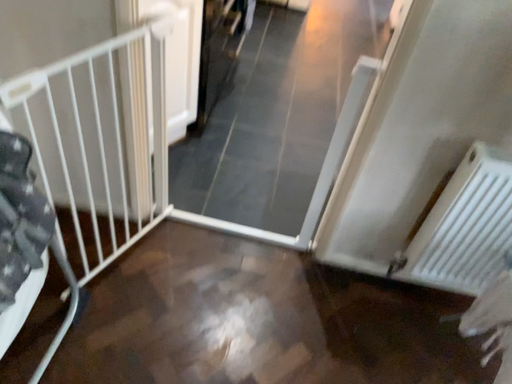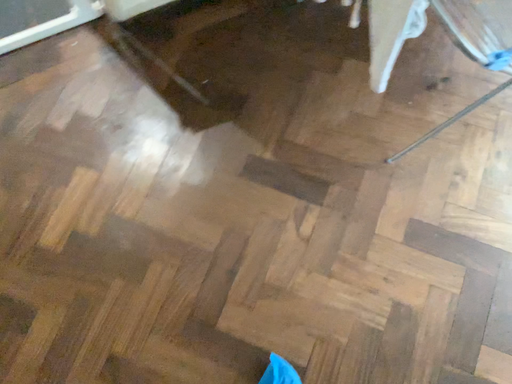
Question: How did the camera likely rotate when shooting the video?

Choices:
 (A) rotated downward
 (B) rotated upward

Answer: (A)